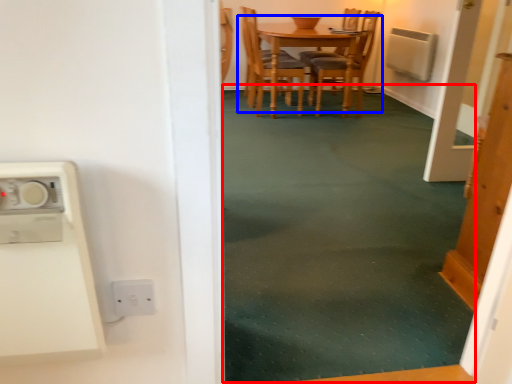
Question: Which object is further to the camera taking this photo, plain (highlighted by a red box) or kitchen & dining room table (highlighted by a blue box)?

Choices:
 (A) plain
 (B) kitchen & dining room table

Answer: (B)